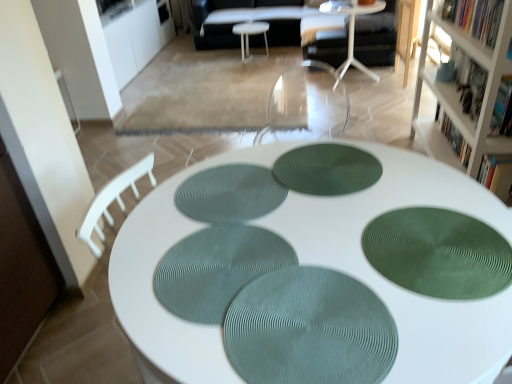
Locate an element on the screen. vacant area located to the right-hand side of teal textured placemat at center, the third mat viewed from the right is located at coordinates (351, 262).